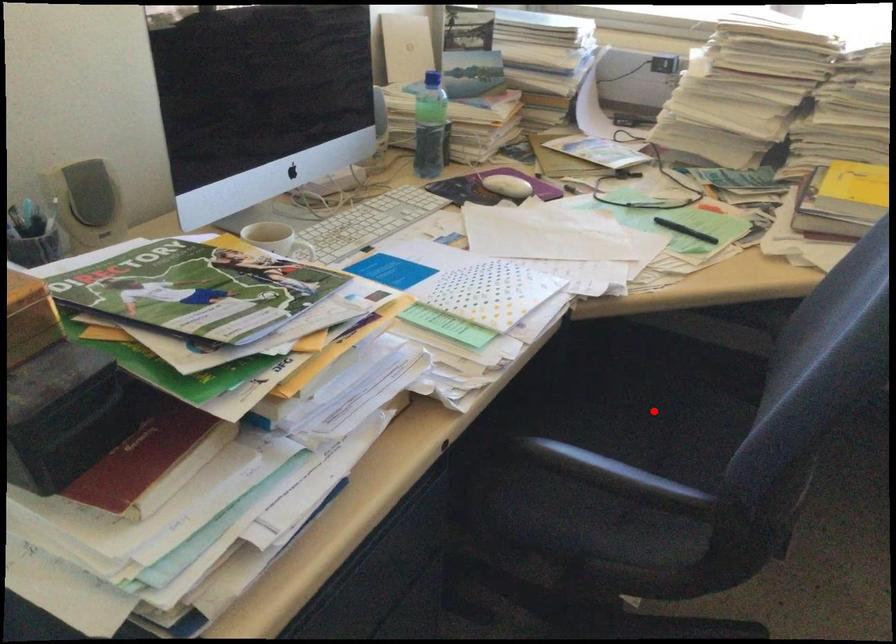
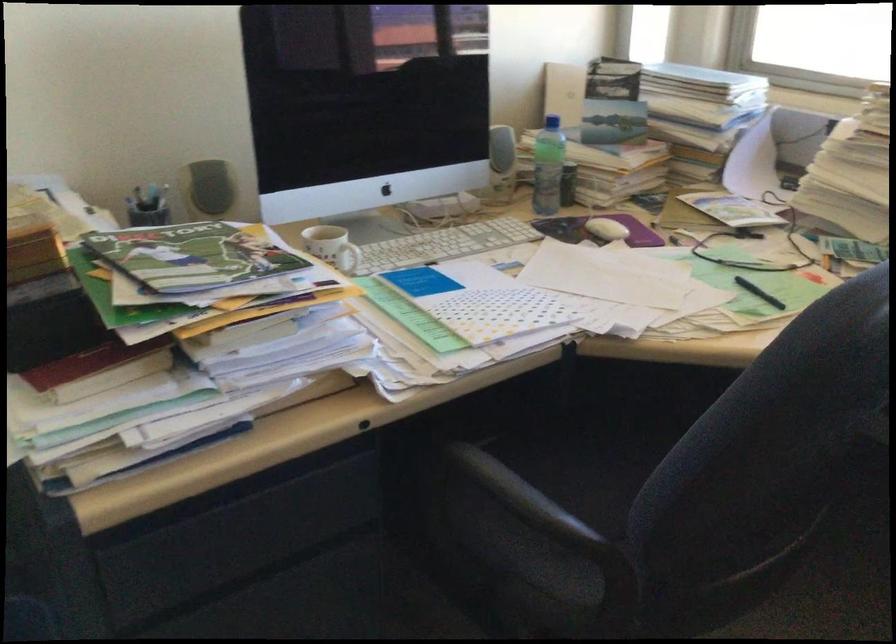
Question: I am providing you with two images of the same scene from different viewpoints. A red point is marked on the first image. Can you still see the location of the red point in image 2?

Choices:
 (A) Yes
 (B) No

Answer: (B)